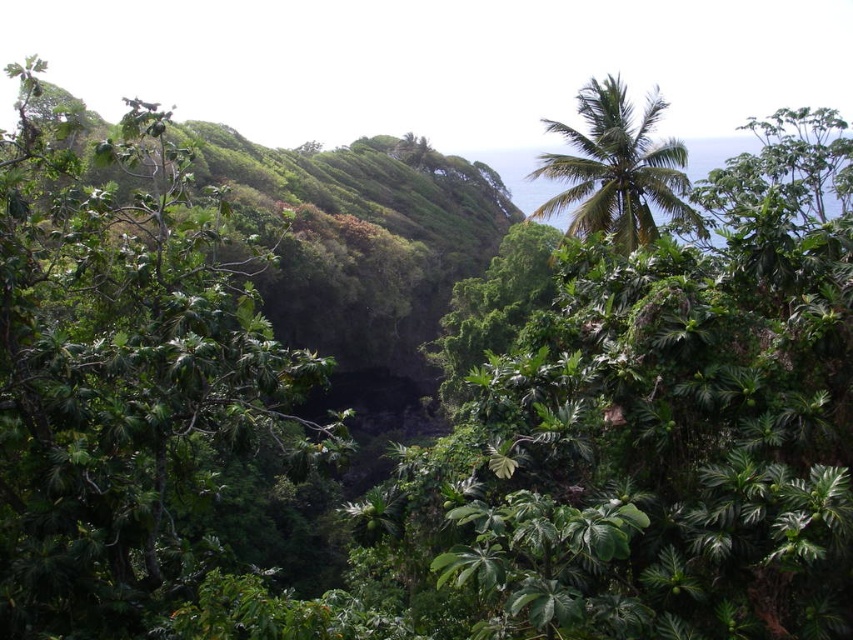
You are planning to plant a new tree in this tropical garden. The green leafy tree at center and the green leafy palm tree at upper right are already present. Which tree has a wider canopy? Please answer based on the existing trees.

The green leafy tree at center has a wider canopy than the green leafy palm tree at upper right because its width surpasses the palm tree.

You are an explorer navigating through the tropical landscape. You see a green leafy tree at center and a green leafy palm tree at upper right. Which tree is positioned higher up in the image?

The green leafy palm tree at upper right is positioned higher up in the image than the green leafy tree at center.

You are an explorer navigating through the tropical jungle and see the green leafy tree at center and the green leafy palm tree at upper right. Which tree is positioned more to the east if you are facing north?

The green leafy palm tree at upper right is positioned more to the east because the green leafy tree at center is to the left of it, and when facing north, left corresponds to west while right corresponds to east.